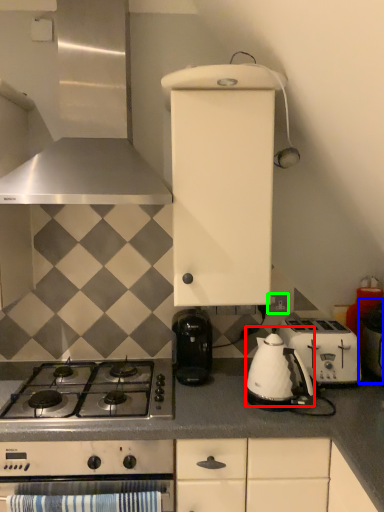
Question: Which object is the closest to the tea pot (highlighted by a red box)? Choose among these: appliance (highlighted by a blue box) or electric outlet (highlighted by a green box).

Choices:
 (A) appliance
 (B) electric outlet

Answer: (A)